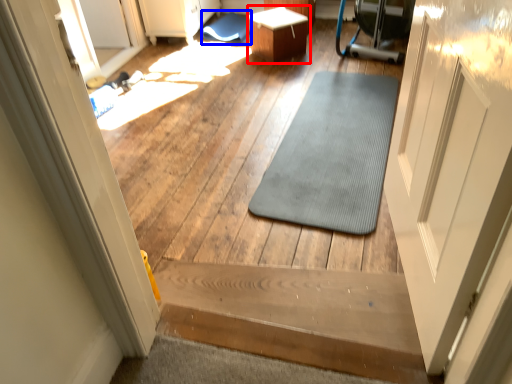
Question: Which point is closer to the camera, table (highlighted by a red box) or bath mat (highlighted by a blue box)?

Choices:
 (A) table
 (B) bath mat

Answer: (A)